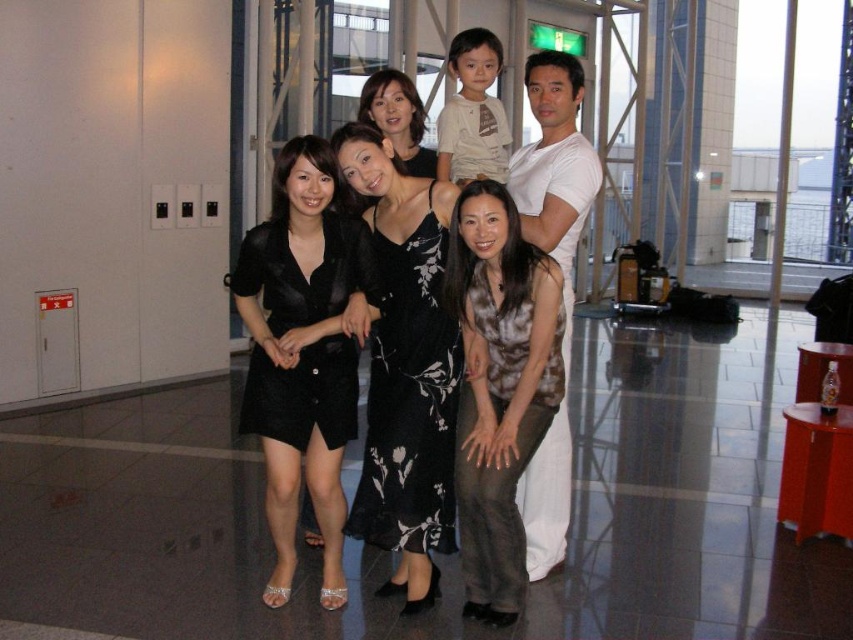
Question: Which point is closer to the camera?

Choices:
 (A) brown textured top at center
 (B) black satin dress at center
 (C) white cotton shirt at right

Answer: (A)

Question: Can you confirm if satin black dress at center is positioned above brown textured top at center?

Choices:
 (A) no
 (B) yes

Answer: (B)

Question: Does black satin dress at center come in front of white cotton shirt at right?

Choices:
 (A) no
 (B) yes

Answer: (A)

Question: Does satin black dress at center appear under black lace dress at center?

Choices:
 (A) no
 (B) yes

Answer: (B)

Question: Which of the following is the farthest from the observer?

Choices:
 (A) 526,230
 (B) 427,166
 (C) 502,275

Answer: (B)

Question: Which point is farther from the camera taking this photo?

Choices:
 (A) click(399, 80)
 (B) click(554, 202)

Answer: (A)